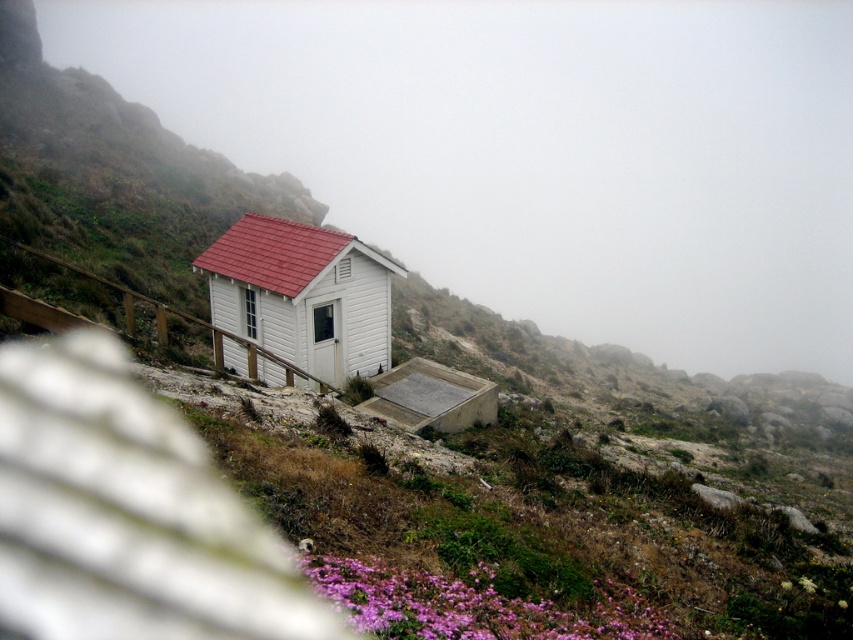
Does point (381, 260) come behind point (602, 636)?

Yes, point (381, 260) is behind point (602, 636).

Does white wood cabin at center have a larger size compared to purple matte flowers at lower center?

No, white wood cabin at center is not bigger than purple matte flowers at lower center.

Locate an element on the screen. white wood cabin at center is located at coordinates (302, 294).

Identify the location of white wood cabin at center. This screenshot has width=853, height=640. (302, 294).